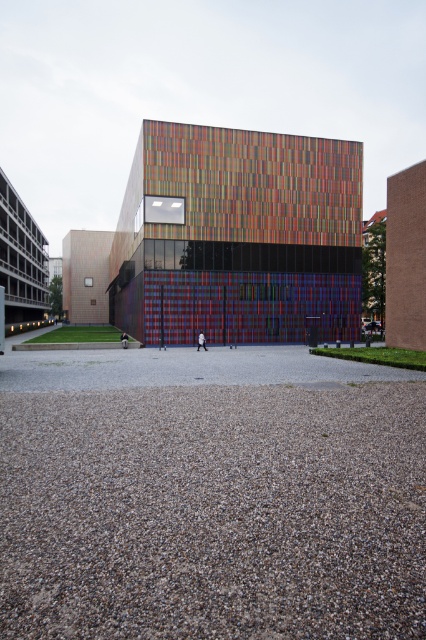
Locate an element on the screen. This screenshot has height=640, width=426. gray gravel at lower center is located at coordinates (213, 513).

Can you confirm if gray gravel at lower center is thinner than multicolored glass building at center?

Yes, gray gravel at lower center is thinner than multicolored glass building at center.

Find the location of a particular element. Image resolution: width=426 pixels, height=640 pixels. gray gravel at lower center is located at coordinates (213, 513).